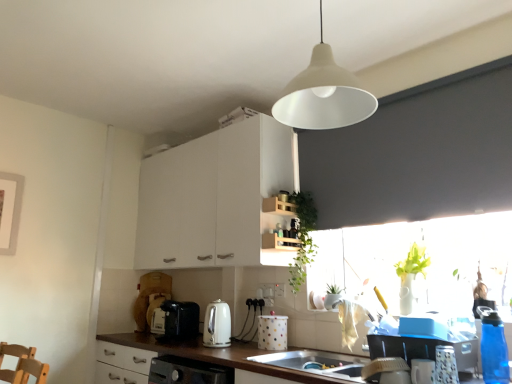
The image size is (512, 384). I want to click on white polka dot container at lower center, which is counted as the second appliance, starting from the left, so click(x=272, y=332).

Image resolution: width=512 pixels, height=384 pixels. What do you see at coordinates (425, 256) in the screenshot?
I see `transparent glass window at right` at bounding box center [425, 256].

Describe the element at coordinates (494, 349) in the screenshot. I see `blue translucent water bottle at right, the 1th appliance from the right` at that location.

What do you see at coordinates (445, 366) in the screenshot? I see `patterned ceramic mug at lower right, which appears as the fifth appliance when viewed from the left` at bounding box center [445, 366].

Locate an element on the screen. white matte lampshade at upper center is located at coordinates 324,95.

Find the location of `white plastic electric outlet at center, the 2th electric outlet from the front`. white plastic electric outlet at center, the 2th electric outlet from the front is located at coordinates (266, 290).

Is white plastic dish brush at lower right, which ranks as the fourth appliance in front-to-back order, wider than patterned ceramic mug at lower right, the 6th appliance when ordered from back to front?

Yes.

Is white plastic dish brush at lower right, which ranks as the fourth appliance in front-to-back order, positioned far away from patterned ceramic mug at lower right, the 6th appliance when ordered from back to front?

That's not correct — white plastic dish brush at lower right, which ranks as the fourth appliance in front-to-back order, is a little close to patterned ceramic mug at lower right, the 6th appliance when ordered from back to front.

How different are the orientations of white plastic dish brush at lower right, which ranks as the fourth appliance in front-to-back order, and patterned ceramic mug at lower right, the 6th appliance when ordered from back to front, in degrees?

They differ by 0.000351 degrees in their facing directions.

Between white plastic dish brush at lower right, positioned as the fourth appliance in back-to-front order, and patterned ceramic mug at lower right, which appears as the fifth appliance when viewed from the left, which one has larger size?

white plastic dish brush at lower right, positioned as the fourth appliance in back-to-front order, is bigger.

Is white matte cabinet at upper center positioned far away from white plastic electric outlet at center, which appears as the 2th electric outlet when viewed from the right?

No.

From the image's perspective, relative to white plastic electric outlet at center, the 1th electric outlet viewed from the left, is white matte cabinet at upper center above or below?

Clearly, from the image's perspective, white matte cabinet at upper center is above white plastic electric outlet at center, the 1th electric outlet viewed from the left.

From a real-world perspective, who is located lower, white matte cabinet at upper center or white plastic electric outlet at center, the 2th electric outlet from the front?

white plastic electric outlet at center, the 2th electric outlet from the front, is physically lower.

Considering the relative sizes of white matte cabinet at upper center and white plastic electric outlet at center, the 1th electric outlet viewed from the left, in the image provided, is white matte cabinet at upper center thinner than white plastic electric outlet at center, the 1th electric outlet viewed from the left,?

No.

Can you confirm if white plastic electric outlet at center, the second electric outlet from the back, is taller than transparent glass window at right?

In fact, white plastic electric outlet at center, the second electric outlet from the back, may be shorter than transparent glass window at right.

Considering the sizes of objects white plastic electric outlet at center, the first electric outlet when ordered from front to back, and transparent glass window at right in the image provided, who is thinner, white plastic electric outlet at center, the first electric outlet when ordered from front to back, or transparent glass window at right?

white plastic electric outlet at center, the first electric outlet when ordered from front to back.

Measure the distance from white plastic electric outlet at center, the first electric outlet when ordered from front to back, to transparent glass window at right.

They are 29.81 inches apart.

Identify the location of appliance that is the 5th one when counting rightward from the wooden shelf at center. (494, 349).

Which is closer, (492, 362) or (278, 265)?

The point (492, 362) is closer to the camera.

Is blue translucent water bottle at right, arranged as the seventh appliance when viewed from the back, completely or partially outside of wooden shelf at center?

Yes, blue translucent water bottle at right, arranged as the seventh appliance when viewed from the back, is outside of wooden shelf at center.

Can you tell me how much blue translucent water bottle at right, arranged as the seventh appliance when viewed from the back, and wooden shelf at center differ in facing direction?

The angular difference between blue translucent water bottle at right, arranged as the seventh appliance when viewed from the back, and wooden shelf at center is 91.9 degrees.

Visually, is white matte lampshade at upper center positioned to the left or to the right of transparent glass window at right?

In the image, white matte lampshade at upper center appears on the left side of transparent glass window at right.

Where is `lamp on the left of transparent glass window at right`? lamp on the left of transparent glass window at right is located at coordinates (324, 95).

How far apart are white matte lampshade at upper center and transparent glass window at right?

They are 37.07 inches apart.

Between white matte lampshade at upper center and transparent glass window at right, which one is positioned behind?

transparent glass window at right is behind.

Considering the sizes of objects white polka dot container at lower center, which is counted as the second appliance, starting from the left, and blue translucent water bottle at right, the 1th appliance from the right, in the image provided, who is smaller, white polka dot container at lower center, which is counted as the second appliance, starting from the left, or blue translucent water bottle at right, the 1th appliance from the right,?

blue translucent water bottle at right, the 1th appliance from the right, is smaller.

Find the location of a particular element. the 5th appliance to the right of the white polka dot container at lower center, the 6th appliance from the front, starting your count from the anchor is located at coordinates (494, 349).

Which object is positioned more to the right, white polka dot container at lower center, acting as the 2th appliance starting from the back, or blue translucent water bottle at right, placed as the 7th appliance when sorted from left to right?

blue translucent water bottle at right, placed as the 7th appliance when sorted from left to right.

Does white polka dot container at lower center, the 6th appliance from the front, turn towards blue translucent water bottle at right, which appears as the first appliance when viewed from the front?

No, white polka dot container at lower center, the 6th appliance from the front, is not aimed at blue translucent water bottle at right, which appears as the first appliance when viewed from the front.

How different are the orientations of white plastic electric outlet at center, the 1th electric outlet viewed from the left, and white plastic electric outlet at center, the second electric outlet from the back, in degrees?

The angle between the facing direction of white plastic electric outlet at center, the 1th electric outlet viewed from the left, and the facing direction of white plastic electric outlet at center, the second electric outlet from the back, is 1.28 degrees.

Is point (267, 287) more distant than point (276, 296)?

Yes, point (267, 287) is farther from viewer.

Can we say white plastic electric outlet at center, which appears as the 2th electric outlet when viewed from the right, lies outside white plastic electric outlet at center, the 1th electric outlet viewed from the right?

Yes.

Considering the sizes of objects white plastic electric outlet at center, the 2th electric outlet from the front, and white plastic electric outlet at center, the 2th electric outlet when ordered from left to right, in the image provided, who is taller, white plastic electric outlet at center, the 2th electric outlet from the front, or white plastic electric outlet at center, the 2th electric outlet when ordered from left to right,?

white plastic electric outlet at center, the 2th electric outlet when ordered from left to right, is taller.

At what (x,y) coordinates should I click in order to perform the action: click on the 2nd appliance to the right of the white plastic dish brush at lower right, arranged as the third appliance when viewed from the left, counting from the anchor's position. Please return your answer as a coordinate pair (x, y). Image resolution: width=512 pixels, height=384 pixels. Looking at the image, I should click on (445, 366).

Which electric outlet is the 2nd one when counting from the back of the white matte cabinet at upper center? Please provide its 2D coordinates.

[(266, 290)]

Estimate the real-world distances between objects in this image. Which object is closer to white matte lampshade at upper center, patterned ceramic mug at lower right, which appears as the fifth appliance when viewed from the left, or white matte cabinet at upper center?

patterned ceramic mug at lower right, which appears as the fifth appliance when viewed from the left, is closer to white matte lampshade at upper center.

Looking at the image, which one is located closer to black plastic toaster at lower center, the 7th appliance viewed from the front, white matte lampshade at upper center or white glossy kettle at center?

white glossy kettle at center lies closer to black plastic toaster at lower center, the 7th appliance viewed from the front, than the other object.

When comparing their distances from transparent glass window at right, does white plastic electric outlet at center, the second electric outlet from the back, or white matte lampshade at upper center seem further?

Among the two, white matte lampshade at upper center is located further to transparent glass window at right.

Consider the image. Considering their positions, is white polka dot container at lower center, which is counted as the second appliance, starting from the left, positioned further to wooden shelf at center than white matte lampshade at upper center?

The object further to wooden shelf at center is white matte lampshade at upper center.

Estimate the real-world distances between objects in this image. Which object is further from green leafy plant at upper center, white plastic electric outlet at center, the 1th electric outlet viewed from the right, or white matte lampshade at upper center?

Based on the image, white matte lampshade at upper center appears to be further to green leafy plant at upper center.

Which object lies nearer to the anchor point white glossy kettle at center, patterned ceramic mug at lower right, the third appliance from the right, or black plastic toaster at lower center, arranged as the first appliance when viewed from the back?

black plastic toaster at lower center, arranged as the first appliance when viewed from the back.

Which object lies nearer to the anchor point blue translucent water bottle at right, placed as the 7th appliance when sorted from left to right, brown wood countertop at lower center or white glossy mug at lower right, the fourth appliance viewed from the left?

Among the two, white glossy mug at lower right, the fourth appliance viewed from the left, is located nearer to blue translucent water bottle at right, placed as the 7th appliance when sorted from left to right.

Considering their positions, is white plastic electric outlet at center, the 2th electric outlet when ordered from left to right, positioned closer to white plastic dish brush at lower right, arranged as the third appliance when viewed from the left, than white glossy mug at lower right, the fourth appliance positioned from the right?

The object closer to white plastic dish brush at lower right, arranged as the third appliance when viewed from the left, is white glossy mug at lower right, the fourth appliance positioned from the right.

Find the location of a particular element. The height and width of the screenshot is (384, 512). kitchen appliance between green leafy plant at upper center and white polka dot container at lower center, which is counted as the second appliance, starting from the left, vertically is located at coordinates (217, 325).

Where is `kitchen appliance between black plastic toaster at lower center, arranged as the first appliance when viewed from the back, and white plastic electric outlet at center, the 2th electric outlet from the front`? This screenshot has height=384, width=512. kitchen appliance between black plastic toaster at lower center, arranged as the first appliance when viewed from the back, and white plastic electric outlet at center, the 2th electric outlet from the front is located at coordinates (217, 325).

Locate an element on the screen. The image size is (512, 384). window screen between white matte lampshade at upper center and black plastic toaster at lower center, the 7th appliance viewed from the front, in the vertical direction is located at coordinates (425, 256).

Locate an element on the screen. The image size is (512, 384). cabinetry located between white plastic dish brush at lower right, arranged as the third appliance when viewed from the left, and white plastic electric outlet at center, which appears as the 2th electric outlet when viewed from the right, in the depth direction is located at coordinates (214, 198).